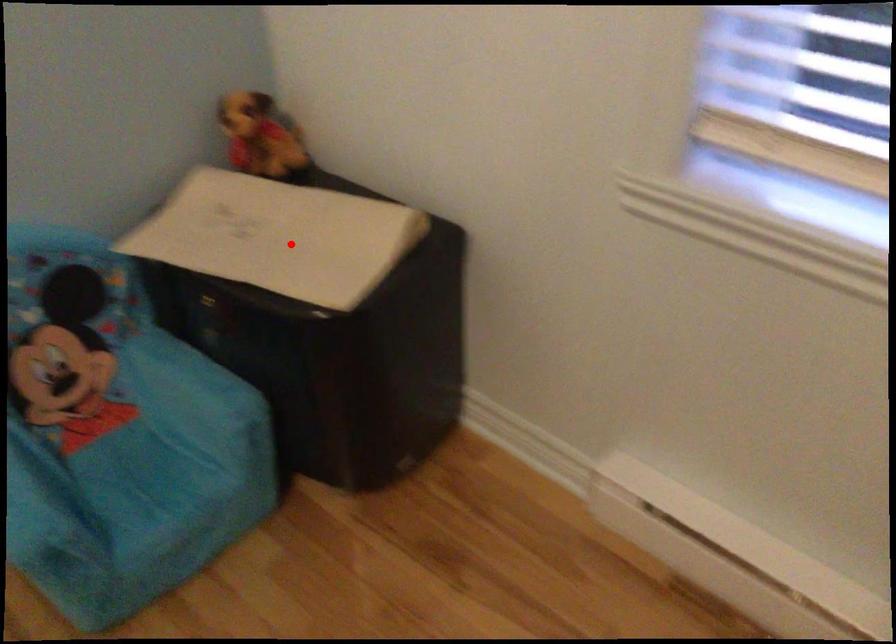
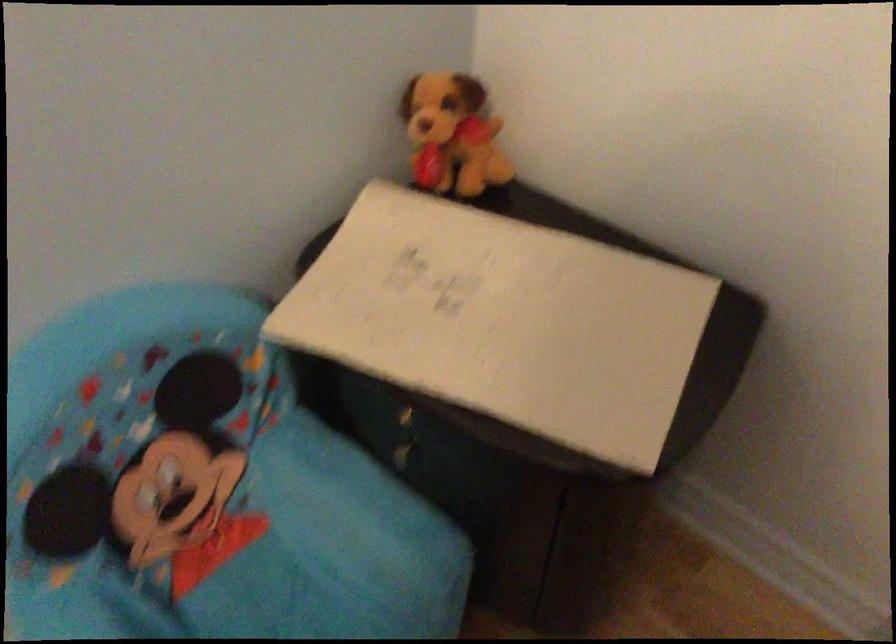
In the second image, find the point that corresponds to the highlighted location in the first image.

(521, 323)